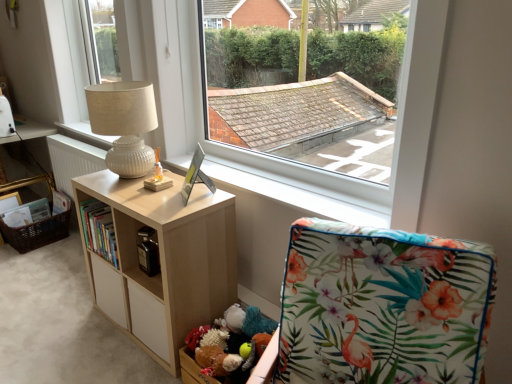
Locate an element on the screen. free space in front of white textured lamp at upper left is located at coordinates [132, 192].